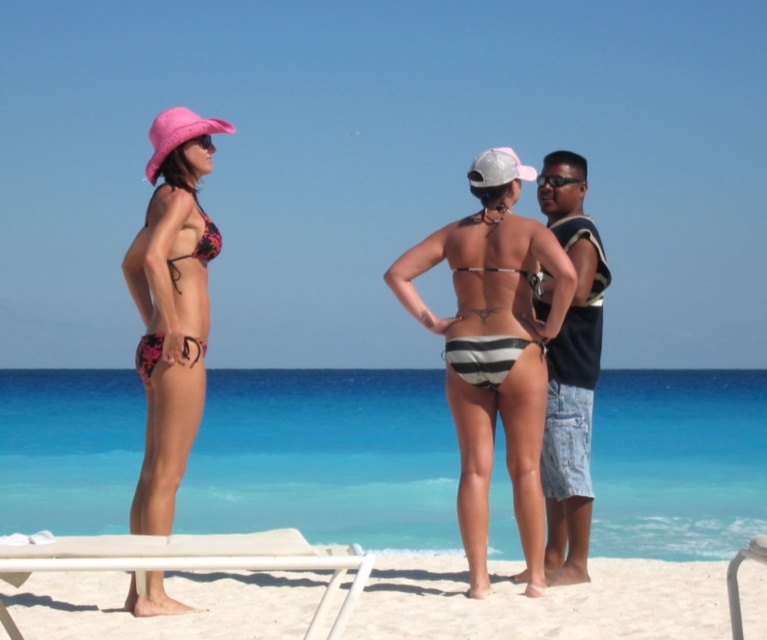
Is the position of denim shorts at center less distant than that of white plastic beach chair at lower left?

No.

Is point (561, 192) less distant than point (337, 564)?

No, it is not.

The height and width of the screenshot is (640, 767). What are the coordinates of `denim shorts at center` in the screenshot? It's located at (571, 388).

Who is more forward, (120, 621) or (157, 401)?

Positioned in front is point (120, 621).

Between white sand at lower center and floral bikini at left, which one has more height?

floral bikini at left is taller.

Between point (696, 609) and point (137, 604), which one is positioned in front?

Positioned in front is point (137, 604).

Find the location of a particular element. This screenshot has width=767, height=640. white sand at lower center is located at coordinates (542, 602).

Does point (143, 337) lie behind point (575, 180)?

That is False.

In the scene shown: Between floral print bikini at left and black plastic goggles at upper center, which one appears on the right side from the viewer's perspective?

From the viewer's perspective, black plastic goggles at upper center appears more on the right side.

Who is more forward, [156,344] or [558,173]?

Point [156,344] is more forward.

The width and height of the screenshot is (767, 640). I want to click on floral print bikini at left, so (x=196, y=243).